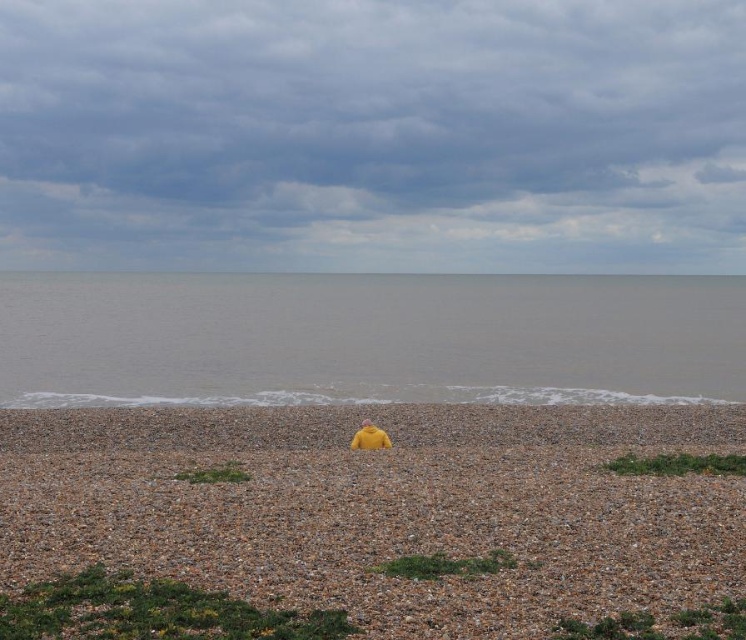
Is yellow fabric at center to the left of gray matte water at center from the viewer's perspective?

Indeed, yellow fabric at center is positioned on the left side of gray matte water at center.

Which of these two, yellow fabric at center or gray matte water at center, stands taller?

gray matte water at center

Who is more distant from viewer, (642, 417) or (712, 330)?

Positioned behind is point (712, 330).

I want to click on yellow fabric at center, so click(x=369, y=522).